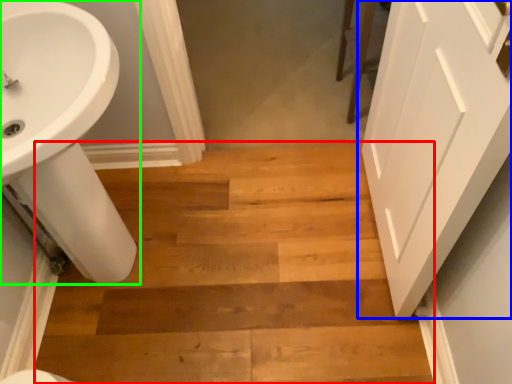
Question: Considering the real-world distances, which object is closest to stairwell (highlighted by a red box)? door (highlighted by a blue box) or sink (highlighted by a green box).

Choices:
 (A) door
 (B) sink

Answer: (B)